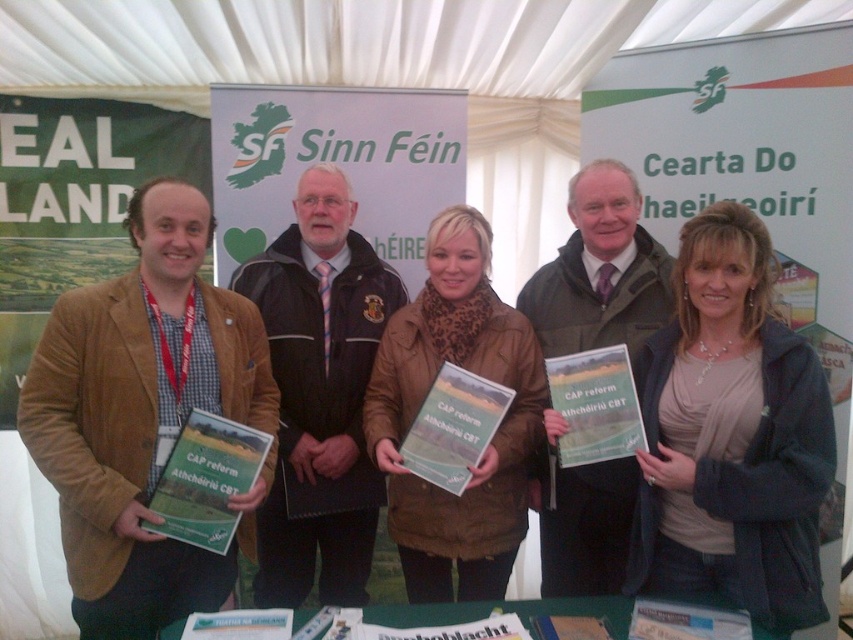
Find the location of a particular element. dark brown leather jacket at center is located at coordinates (318, 394).

Between dark brown leather jacket at center and matte black jacket at center, which one appears on the left side from the viewer's perspective?

From the viewer's perspective, dark brown leather jacket at center appears more on the left side.

The image size is (853, 640). Describe the element at coordinates (318, 394) in the screenshot. I see `dark brown leather jacket at center` at that location.

Where is `dark brown leather jacket at center`? dark brown leather jacket at center is located at coordinates (318, 394).

Measure the distance from brown suede jacket at left to brown leather jacket at center.

The distance of brown suede jacket at left from brown leather jacket at center is 23.15 inches.

Which of these two, brown suede jacket at left or brown leather jacket at center, stands taller?

Standing taller between the two is brown leather jacket at center.

This screenshot has height=640, width=853. Find the location of `brown suede jacket at left`. brown suede jacket at left is located at coordinates (141, 413).

Where is `brown suede jacket at left`? The height and width of the screenshot is (640, 853). brown suede jacket at left is located at coordinates (141, 413).

Who is taller, brown textured jacket at center or brown leather jacket at center?

Standing taller between the two is brown leather jacket at center.

You are a GUI agent. You are given a task and a screenshot of the screen. Output one action in this format:
    pyautogui.click(x=<x>, y=<y>)
    Task: Click on the brown textured jacket at center
    This screenshot has width=853, height=640.
    Given the screenshot: What is the action you would take?
    pyautogui.click(x=730, y=436)